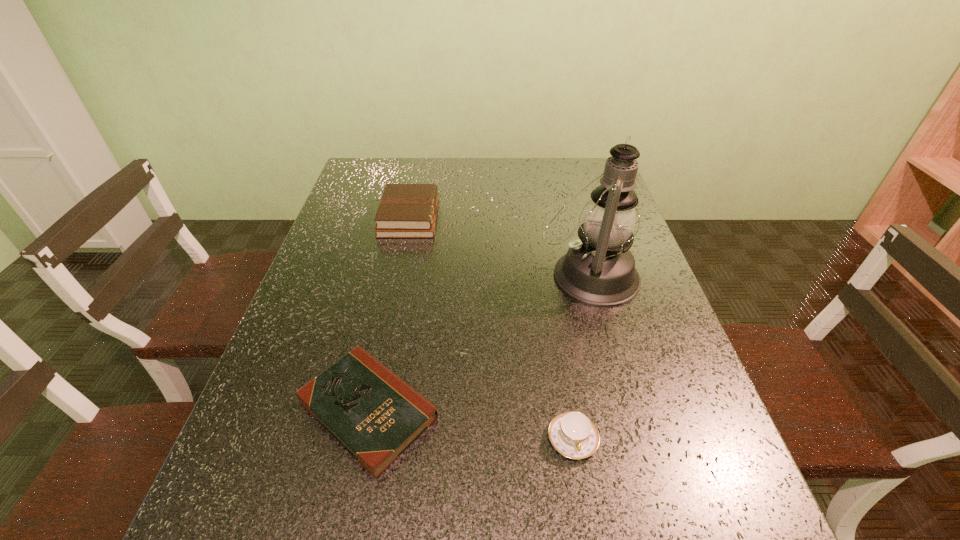
The width and height of the screenshot is (960, 540). What are the coordinates of `the tallest object` in the screenshot? It's located at (599, 270).

Find the location of a particular element. The width and height of the screenshot is (960, 540). the third nearest object is located at coordinates (599, 270).

The height and width of the screenshot is (540, 960). What are the coordinates of `the farther Bible` in the screenshot? It's located at (405, 210).

Image resolution: width=960 pixels, height=540 pixels. Identify the location of the taller Bible. (405, 210).

You are a GUI agent. You are given a task and a screenshot of the screen. Output one action in this format:
    pyautogui.click(x=<x>, y=<y>)
    Task: Click on the second shortest object
    
    Given the screenshot: What is the action you would take?
    pyautogui.click(x=572, y=434)

Locate an element on the screen. The image size is (960, 540). the shorter Bible is located at coordinates (375, 415).

Where is `the shortest object`? This screenshot has height=540, width=960. the shortest object is located at coordinates (375, 415).

What are the coordinates of `vacant area situated 0.220m on the front of the oil lamp` in the screenshot? It's located at (619, 388).

You are a GUI agent. You are given a task and a screenshot of the screen. Output one action in this format:
    pyautogui.click(x=<x>, y=<y>)
    Task: Click on the free space located on the spine side of the farther Bible
    The height and width of the screenshot is (540, 960).
    Given the screenshot: What is the action you would take?
    pyautogui.click(x=513, y=217)

Find the location of a particular element. Image resolution: width=960 pixels, height=540 pixels. vacant space positioned on the side with the handle of the third tallest object is located at coordinates (586, 521).